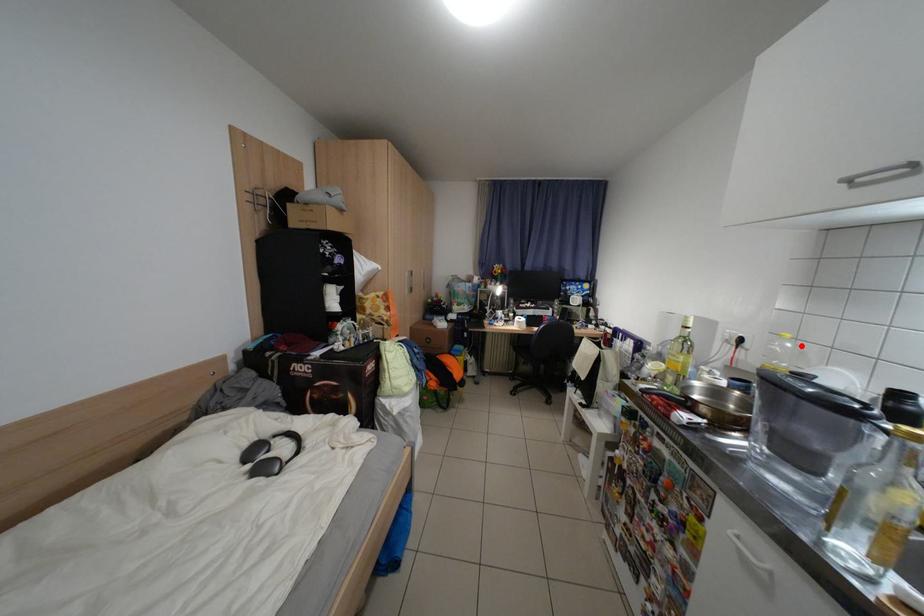
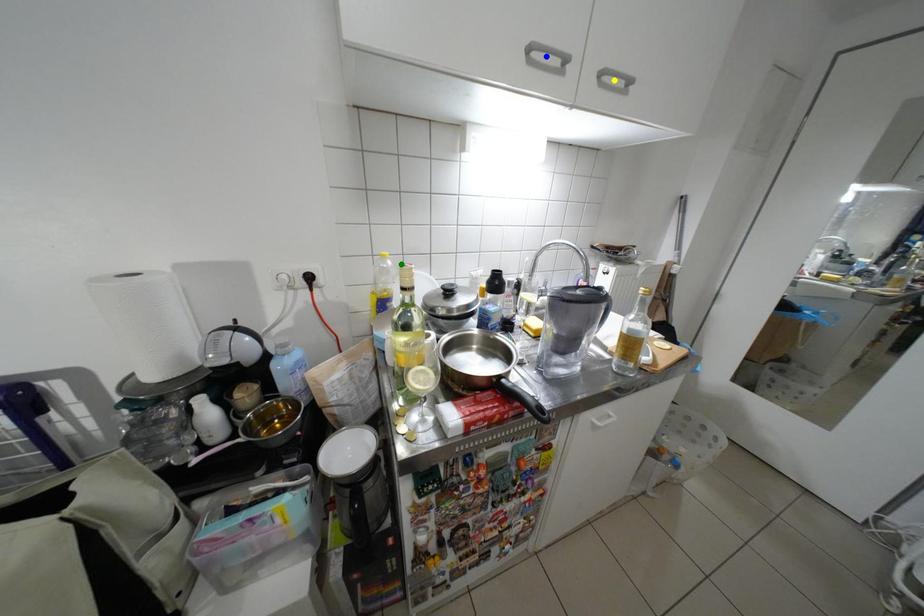
Question: I am providing you with two images of the same scene from different viewpoints. A red point is marked on the first image. You are given multiple points on the second image. Which point in image 2 represents the same 3d spot as the red point in image 1?

Choices:
 (A) blue point
 (B) yellow point
 (C) green point

Answer: (C)